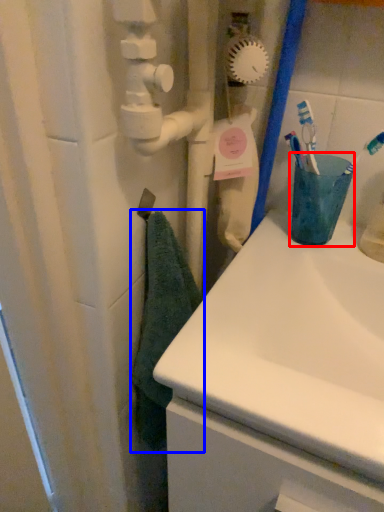
Question: Which point is closer to the camera, turquoise (highlighted by a red box) or bath towel (highlighted by a blue box)?

Choices:
 (A) turquoise
 (B) bath towel

Answer: (B)